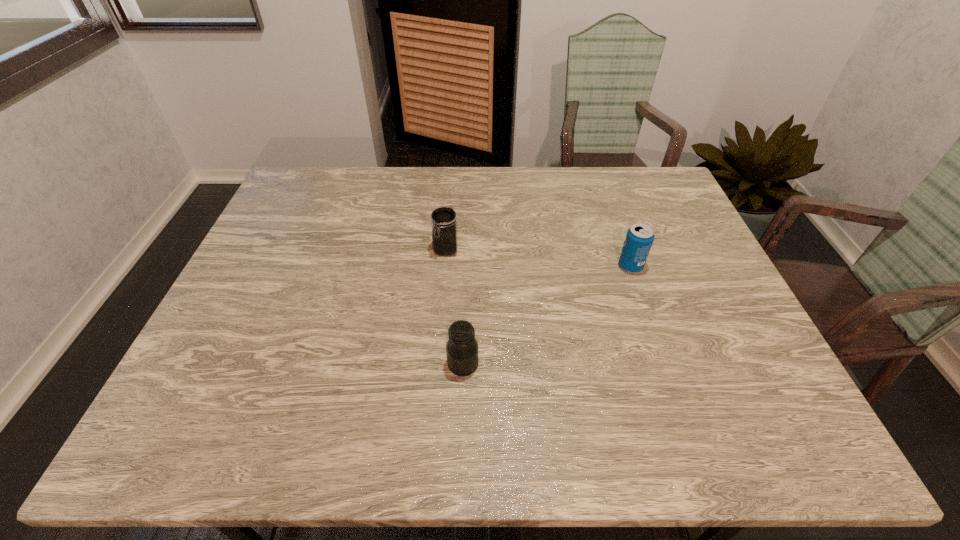
Find the location of a particular element. The width and height of the screenshot is (960, 540). object that stands as the closest to the farther jar is located at coordinates (462, 348).

The image size is (960, 540). What are the coordinates of `object that is the closest to the farther jar` in the screenshot? It's located at (462, 348).

Locate an element on the screen. This screenshot has width=960, height=540. vacant space that satisfies the following two spatial constraints: 1. on the lid of the farther jar; 2. on the left side of the soda can is located at coordinates (444, 266).

Find the location of a particular element. blank space that satisfies the following two spatial constraints: 1. on the lid of the farther jar; 2. on the right side of the rightmost object is located at coordinates (444, 266).

Where is `free space that satisfies the following two spatial constraints: 1. on the lid of the soda can; 2. on the right side of the farther jar`? The width and height of the screenshot is (960, 540). free space that satisfies the following two spatial constraints: 1. on the lid of the soda can; 2. on the right side of the farther jar is located at coordinates (444, 266).

Identify the location of vacant region that satisfies the following two spatial constraints: 1. on the lid of the nearer jar; 2. on the left side of the farther jar. (437, 364).

Where is `vacant point that satisfies the following two spatial constraints: 1. on the lid of the nearer jar; 2. on the left side of the farther jar`? vacant point that satisfies the following two spatial constraints: 1. on the lid of the nearer jar; 2. on the left side of the farther jar is located at coordinates (437, 364).

Identify the location of blank area in the image that satisfies the following two spatial constraints: 1. on the lid of the nearer jar; 2. on the left side of the farther jar. (437, 364).

Locate an element on the screen. The width and height of the screenshot is (960, 540). vacant position in the image that satisfies the following two spatial constraints: 1. on the lid of the soda can; 2. on the right side of the farther jar is located at coordinates (444, 266).

This screenshot has height=540, width=960. I want to click on free space in the image that satisfies the following two spatial constraints: 1. on the lid of the farther jar; 2. on the right side of the rightmost object, so click(444, 266).